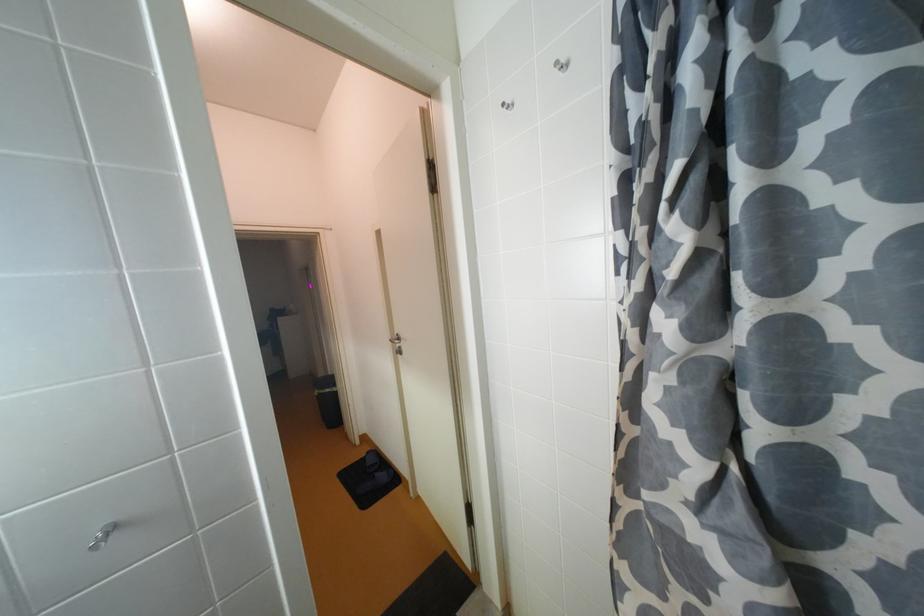
Identify the location of silver door handle. (395, 339).